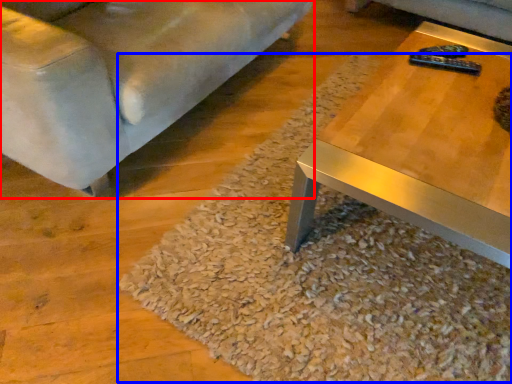
Question: Which object is further to the camera taking this photo, studio couch (highlighted by a red box) or gravel (highlighted by a blue box)?

Choices:
 (A) studio couch
 (B) gravel

Answer: (B)